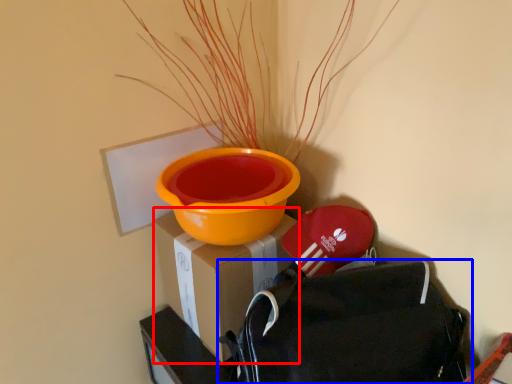
Question: Which of the following is the farthest to the observer, cardboard box (highlighted by a red box) or backpack (highlighted by a blue box)?

Choices:
 (A) cardboard box
 (B) backpack

Answer: (A)